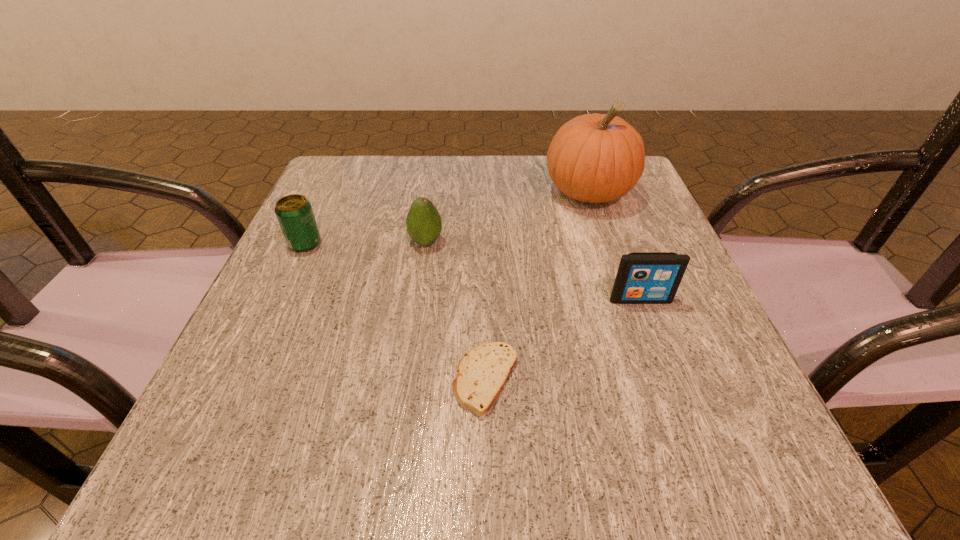
Where is `vacant space in between the pumpkin and the pita bread`? vacant space in between the pumpkin and the pita bread is located at coordinates (537, 286).

Identify the location of free space between the avocado and the pita bread. (456, 311).

Find the location of a particular element. The width and height of the screenshot is (960, 540). vacant space that is in between the second nearest object and the tallest object is located at coordinates (614, 246).

In order to click on the second closest object to the beer can in this screenshot , I will do `click(482, 373)`.

Identify which object is the closest to the iPod. Please provide its 2D coordinates. Your answer should be formatted as a tuple, i.e. [(x, y)], where the tuple contains the x and y coordinates of a point satisfying the conditions above.

[(482, 373)]